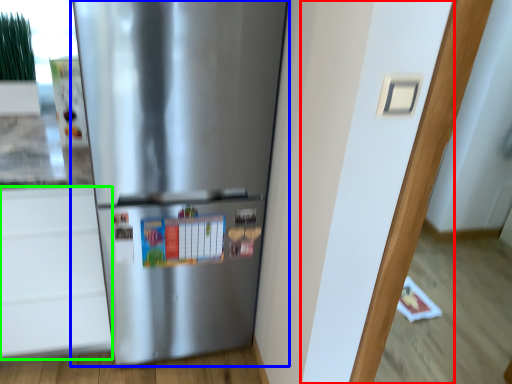
Question: Which is nearer to the door (highlighted by a red box)? refrigerator (highlighted by a blue box) or drawer (highlighted by a green box).

Choices:
 (A) refrigerator
 (B) drawer

Answer: (A)